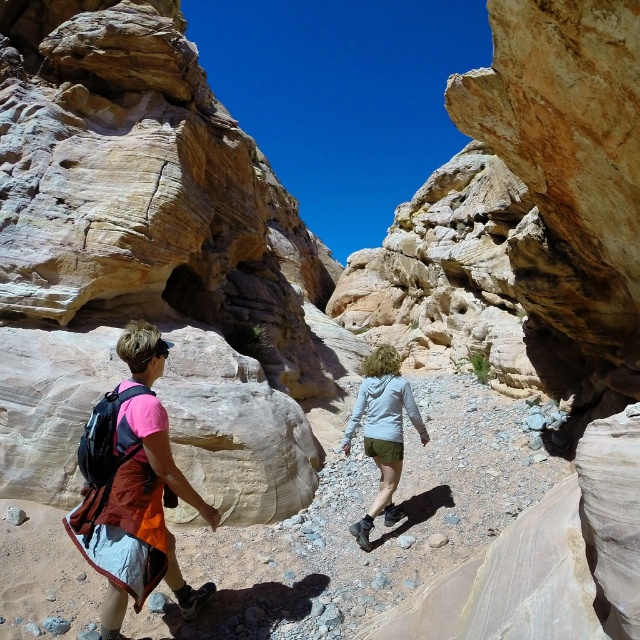
Which is in front, point (141, 369) or point (390, 486)?

Point (141, 369) is more forward.

Between matte pink shirt at center and white matte jacket at center, which one has less height?

Standing shorter between the two is white matte jacket at center.

Identify the location of matte pink shirt at center. pyautogui.click(x=136, y=493).

Based on the photo, which is more to the left, matte fabric backpack at left or white matte jacket at center?

matte fabric backpack at left is more to the left.

Is point (77, 611) positioned behind point (397, 438)?

No, (77, 611) is in front of (397, 438).

Where is `matte fabric backpack at left`? This screenshot has height=640, width=640. matte fabric backpack at left is located at coordinates (374, 525).

Identify the location of matte fabric backpack at left. (374, 525).

Who is lower down, matte fabric backpack at left or matte pink shirt at center?

Positioned lower is matte fabric backpack at left.

Can you confirm if matte fabric backpack at left is positioned below matte pink shirt at center?

Yes.

Where is `matte fabric backpack at left`? This screenshot has height=640, width=640. matte fabric backpack at left is located at coordinates (374, 525).